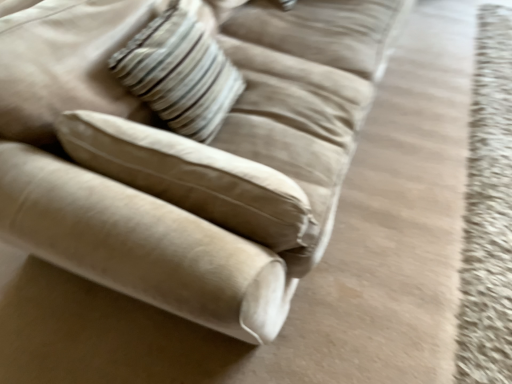
Question: Is suede beige couch at upper left taller or shorter than striped fabric pillow at upper center?

Choices:
 (A) tall
 (B) short

Answer: (A)

Question: Is suede beige couch at upper left in front of or behind striped fabric pillow at upper center in the image?

Choices:
 (A) front
 (B) behind

Answer: (A)

Question: Considering the positions of point (69, 28) and point (181, 56), is point (69, 28) closer or farther from the camera than point (181, 56)?

Choices:
 (A) closer
 (B) farther

Answer: (A)

Question: Is striped fabric pillow at upper center situated inside suede beige couch at upper left or outside?

Choices:
 (A) inside
 (B) outside

Answer: (A)

Question: Does point (160, 44) appear closer or farther from the camera than point (294, 271)?

Choices:
 (A) farther
 (B) closer

Answer: (A)

Question: In the image, is striped fabric pillow at upper center on the left side or the right side of suede beige couch at upper left?

Choices:
 (A) right
 (B) left

Answer: (B)

Question: In terms of height, does striped fabric pillow at upper center look taller or shorter compared to suede beige couch at upper left?

Choices:
 (A) short
 (B) tall

Answer: (A)